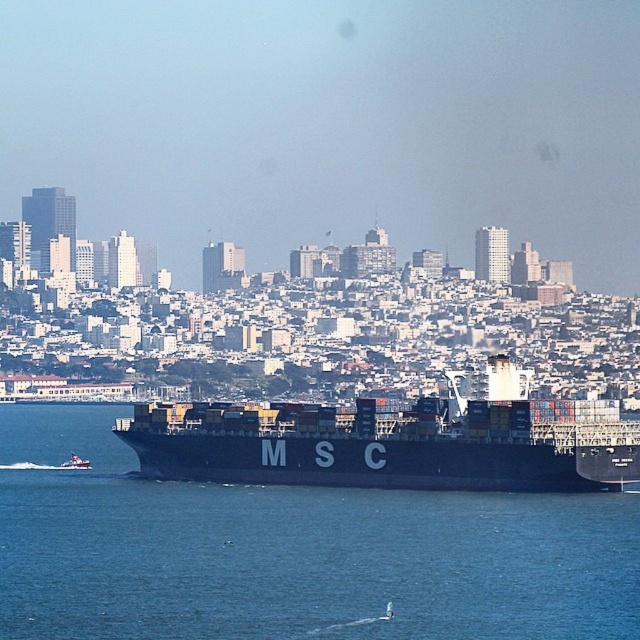
Between black matte cargo ship at center and white glossy boat at lower left, which one appears on the left side from the viewer's perspective?

Positioned to the left is white glossy boat at lower left.

Between point (577, 420) and point (61, 468), which one is positioned in front?

Point (577, 420) is more forward.

Locate an element on the screen. This screenshot has height=640, width=640. black matte cargo ship at center is located at coordinates (396, 440).

Does black matte water at center have a greater width compared to white glossy boat at lower left?

Correct, the width of black matte water at center exceeds that of white glossy boat at lower left.

Does black matte water at center lie behind white glossy boat at lower left?

No.

Between point (52, 426) and point (74, 465), which one is positioned behind?

The point (52, 426) is more distant.

At what (x,y) coordinates should I click in order to perform the action: click on black matte water at center. Please return your answer as a coordinate pair (x, y). Looking at the image, I should click on (292, 552).

Is black matte water at center below black matte cargo ship at center?

Indeed, black matte water at center is positioned under black matte cargo ship at center.

Identify the location of black matte water at center. (292, 552).